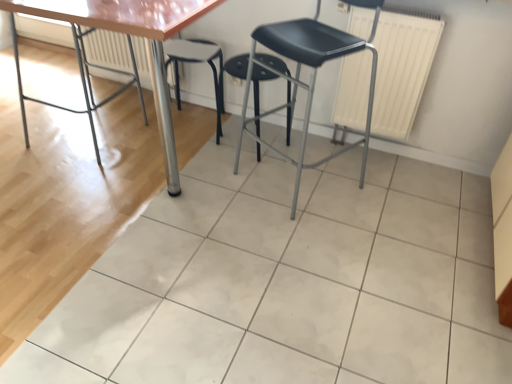
You are a GUI agent. You are given a task and a screenshot of the screen. Output one action in this format:
    pyautogui.click(x=<x>, y=<y>)
    Task: Click on the vacant space in between metallic polished table at left and black plastic stool at center, arranged as the 1th stool when viewed from the left
    This screenshot has height=384, width=512.
    Given the screenshot: What is the action you would take?
    pyautogui.click(x=146, y=140)